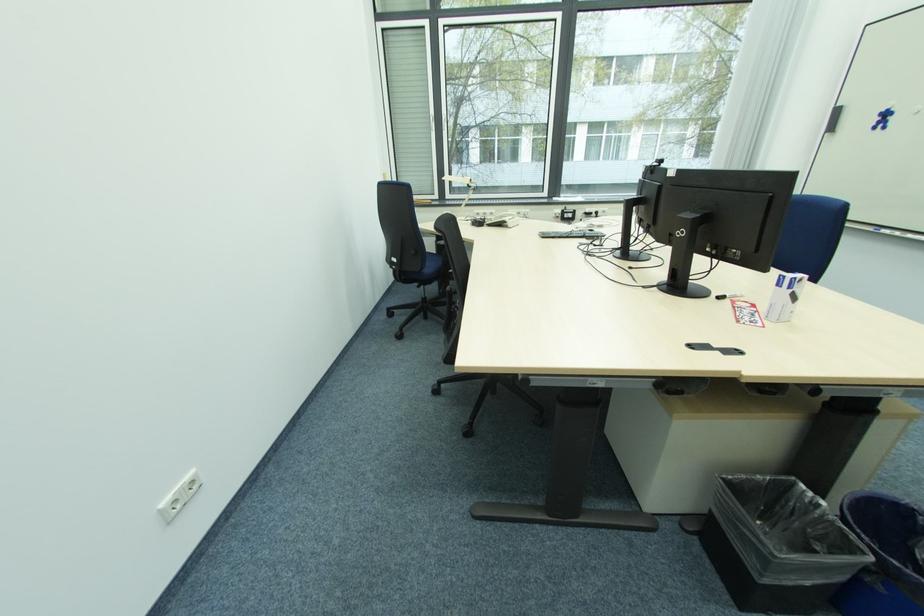
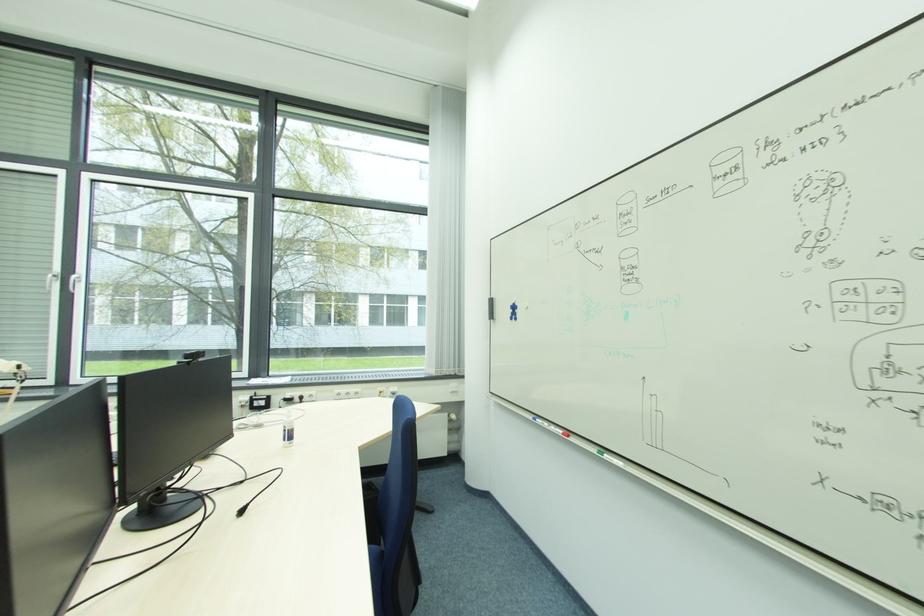
Find the pixel in the second image that matches point (881, 121) in the first image.

(515, 313)